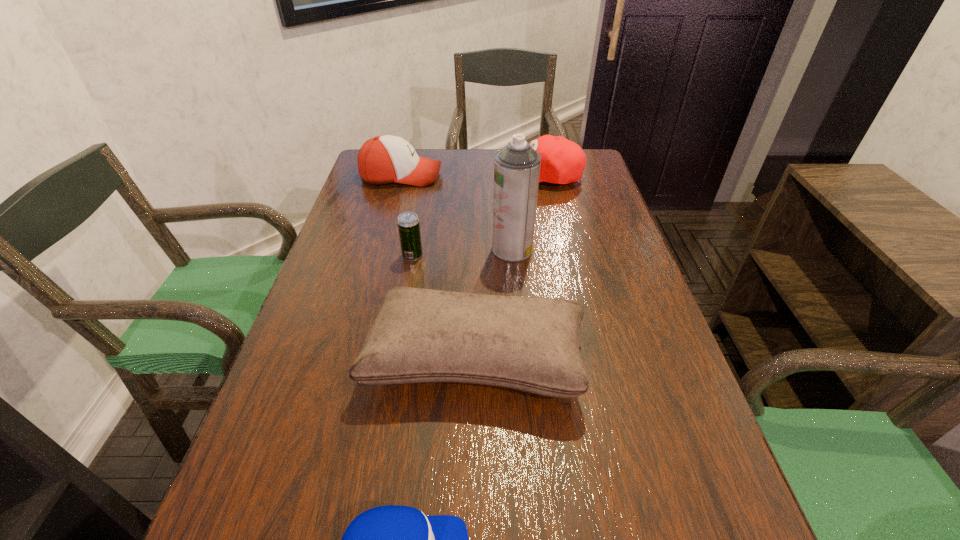
This screenshot has height=540, width=960. I want to click on cushion positioned at the left edge, so click(x=531, y=344).

In order to click on baseball cap located at the left edge in this screenshot , I will do `click(384, 159)`.

You are a GUI agent. You are given a task and a screenshot of the screen. Output one action in this format:
    pyautogui.click(x=<x>, y=<y>)
    Task: Click on the object positioned at the right edge
    
    Given the screenshot: What is the action you would take?
    pyautogui.click(x=562, y=161)

Locate an element on the screen. object that is at the far left corner is located at coordinates (384, 159).

Identify the location of object located at the far right corner. (562, 161).

Locate an element on the screen. vacant space at the left edge of the desktop is located at coordinates (277, 445).

At what (x,y) coordinates should I click in order to perform the action: click on free location at the right edge. Please return your answer as a coordinate pair (x, y). The width and height of the screenshot is (960, 540). Looking at the image, I should click on (592, 312).

In order to click on vacant area that lies between the aerosol can and the beer can in this screenshot , I will do `click(463, 252)`.

At what (x,y) coordinates should I click in order to perform the action: click on object that is the fourth closest to the nearest object. Please return your answer as a coordinate pair (x, y). Looking at the image, I should click on (562, 161).

Identify the location of the second closest object to the beer can. The width and height of the screenshot is (960, 540). (531, 344).